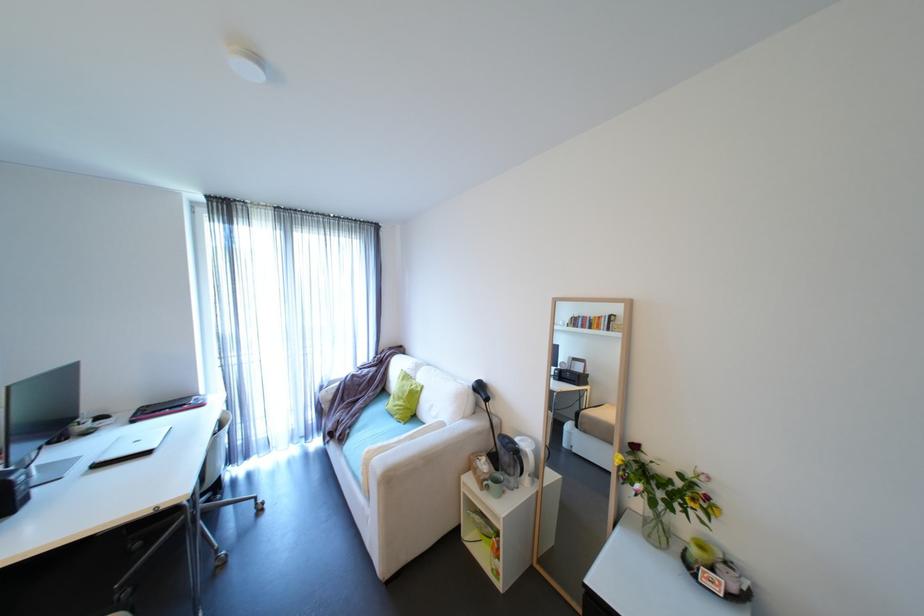
The location [516,460] corresponds to which object?

It corresponds to the white electric kettle in the image.